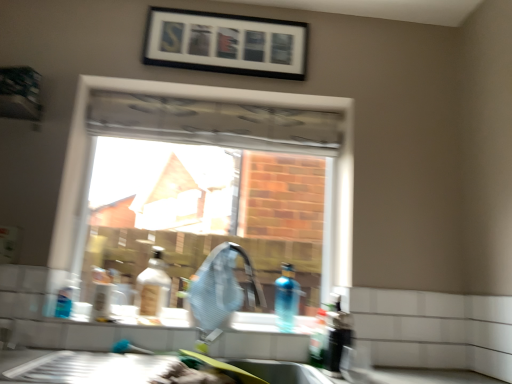
Question: Does matte silver faucet at center have a greater width compared to white glossy counter top at lower left?

Choices:
 (A) no
 (B) yes

Answer: (A)

Question: From a real-world perspective, is matte silver faucet at center under white glossy counter top at lower left?

Choices:
 (A) no
 (B) yes

Answer: (A)

Question: Is matte silver faucet at center outside of white glossy counter top at lower left?

Choices:
 (A) yes
 (B) no

Answer: (A)

Question: Considering the relative sizes of matte silver faucet at center and white glossy counter top at lower left in the image provided, is matte silver faucet at center bigger than white glossy counter top at lower left?

Choices:
 (A) yes
 (B) no

Answer: (B)

Question: Is matte silver faucet at center next to white glossy counter top at lower left and touching it?

Choices:
 (A) no
 (B) yes

Answer: (A)

Question: Is white glossy counter top at lower left completely or partially inside matte silver faucet at center?

Choices:
 (A) no
 (B) yes

Answer: (A)

Question: Is blue translucent bottle at sink, the third bottle from the right, at the back of translucent blue bottle at lower right, the fifth bottle from the left?

Choices:
 (A) no
 (B) yes

Answer: (A)

Question: From a real-world perspective, does translucent blue bottle at lower right, the fifth bottle from the left, stand above blue translucent bottle at sink, the 3th bottle positioned from the left?

Choices:
 (A) yes
 (B) no

Answer: (B)

Question: Is translucent blue bottle at lower right, the fifth bottle from the left, located outside blue translucent bottle at sink, the third bottle from the right?

Choices:
 (A) no
 (B) yes

Answer: (B)

Question: Is translucent blue bottle at lower right, the 1th bottle from the right, to the left of blue translucent bottle at sink, the 3th bottle positioned from the left, from the viewer's perspective?

Choices:
 (A) yes
 (B) no

Answer: (B)

Question: Does translucent blue bottle at lower right, the fifth bottle from the left, have a larger size compared to blue translucent bottle at sink, the third bottle from the right?

Choices:
 (A) yes
 (B) no

Answer: (B)

Question: From the image's perspective, is translucent blue bottle at lower right, the fifth bottle from the left, under blue translucent bottle at sink, the third bottle from the right?

Choices:
 (A) yes
 (B) no

Answer: (A)

Question: Is white glossy counter top at lower left to the left of black matte picture frame at upper center from the viewer's perspective?

Choices:
 (A) no
 (B) yes

Answer: (B)